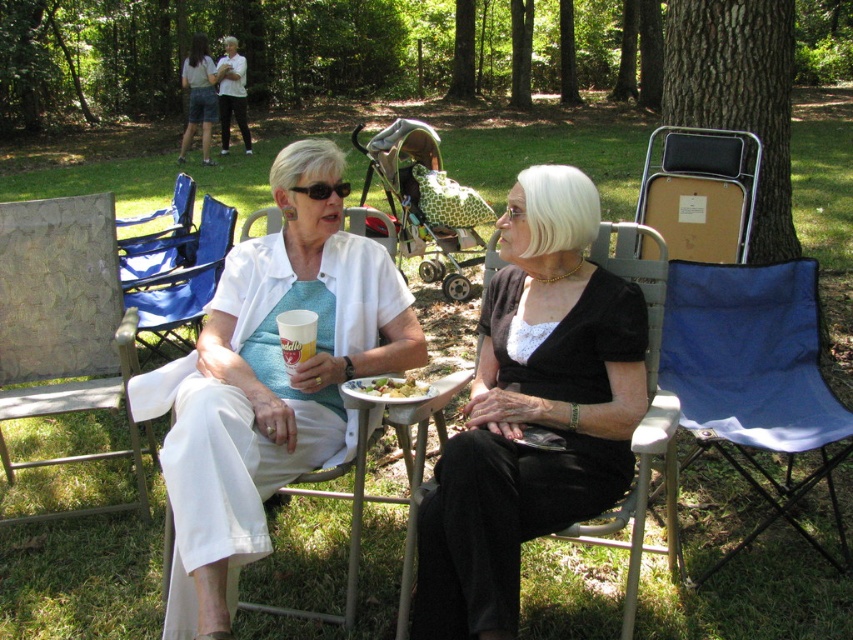
Can you confirm if black satin dress at center is smaller than blue fabric chair at left?

Yes.

Identify the location of black satin dress at center. This screenshot has height=640, width=853. (532, 410).

Between black satin dress at center and blue fabric chair at right, which one has less height?

blue fabric chair at right is shorter.

Can you confirm if black satin dress at center is smaller than blue fabric chair at right?

Yes.

Does point (440, 502) lie in front of point (798, 362)?

Yes.

The height and width of the screenshot is (640, 853). I want to click on black satin dress at center, so click(x=532, y=410).

What do you see at coordinates (387, 388) in the screenshot? The height and width of the screenshot is (640, 853). I see `green matte salad at lower center` at bounding box center [387, 388].

Can you confirm if green matte salad at lower center is positioned to the right of black plastic sunglasses at upper center?

Indeed, green matte salad at lower center is positioned on the right side of black plastic sunglasses at upper center.

Is point (408, 390) farther from viewer compared to point (297, 188)?

That is False.

The height and width of the screenshot is (640, 853). I want to click on green matte salad at lower center, so click(x=387, y=388).